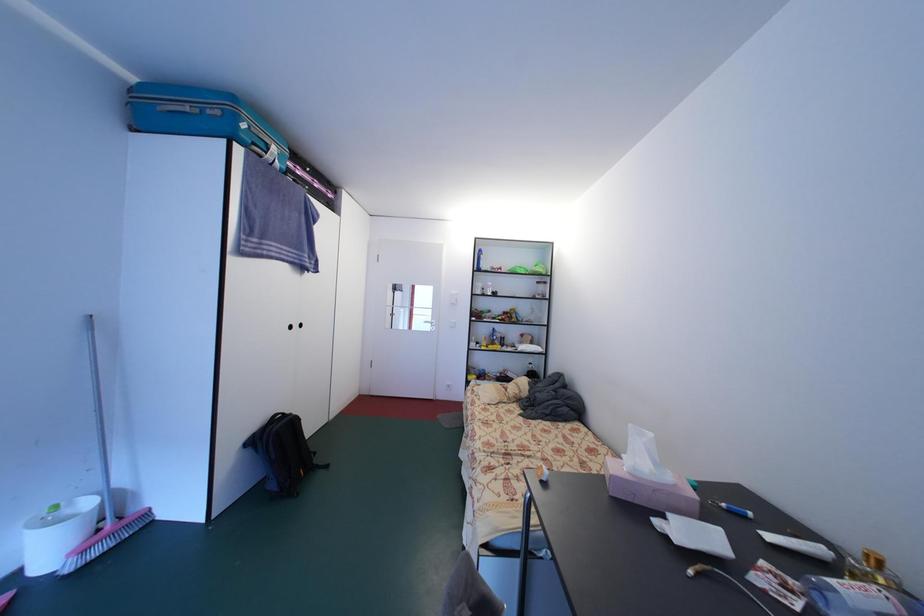
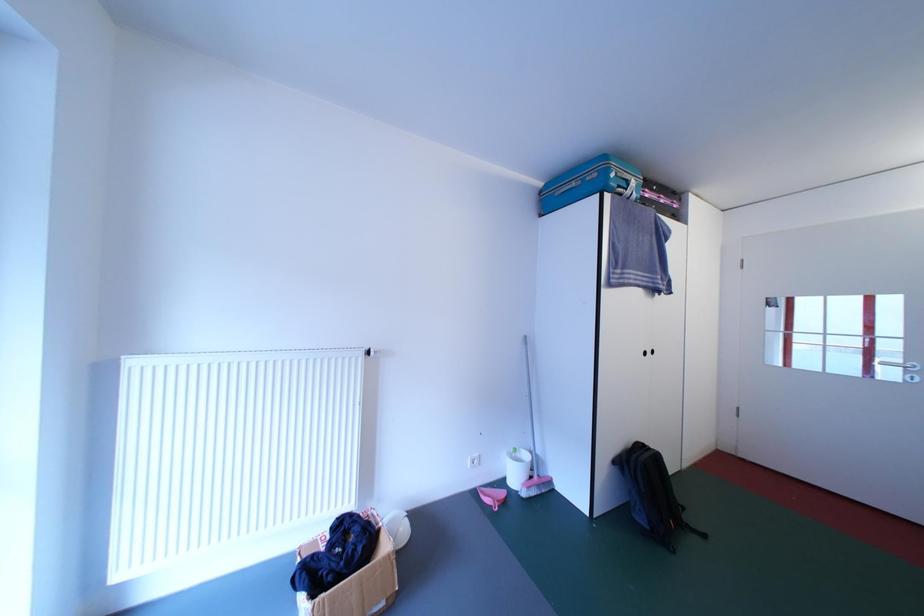
Question: The first image is from the beginning of the video and the second image is from the end. How did the camera likely rotate when shooting the video?

Choices:
 (A) Left
 (B) Right
 (C) Up
 (D) Down

Answer: (A)